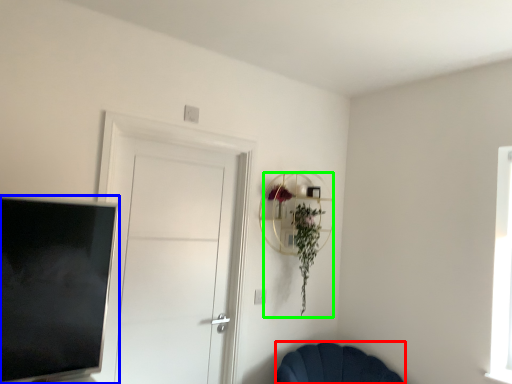
Question: Considering the real-world distances, which object is closest to chair (highlighted by a red box)? television (highlighted by a blue box) or floral arrangement (highlighted by a green box).

Choices:
 (A) television
 (B) floral arrangement

Answer: (B)